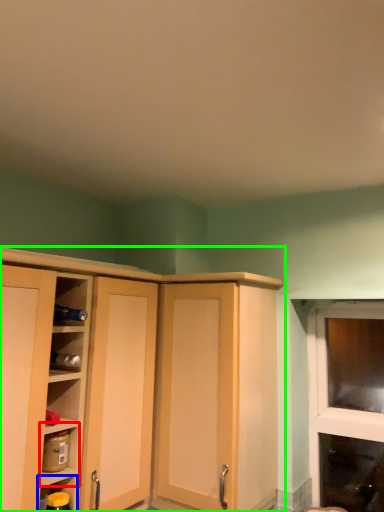
Question: Which object is the farthest from shelf (highlighted by a red box)? Choose among these: shelf (highlighted by a blue box) or cupboard (highlighted by a green box).

Choices:
 (A) shelf
 (B) cupboard

Answer: (B)